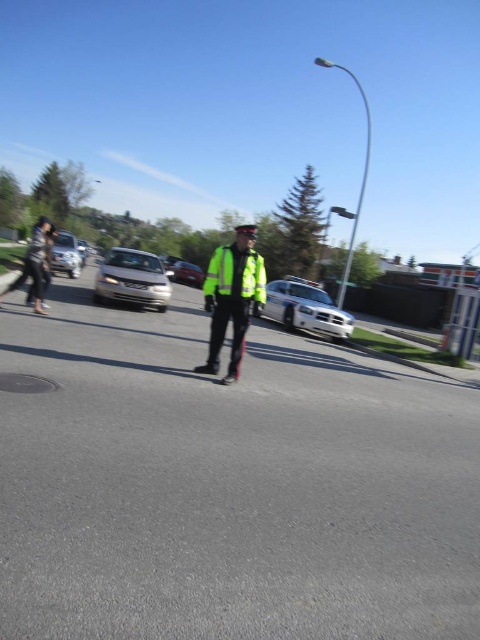
Does high visibility reflective jacket at center have a lesser height compared to satin silver sedan at center?

Yes, high visibility reflective jacket at center is shorter than satin silver sedan at center.

Does high visibility reflective jacket at center have a smaller size compared to satin silver sedan at center?

Indeed, high visibility reflective jacket at center has a smaller size compared to satin silver sedan at center.

Does point (250, 260) lie in front of point (97, 284)?

Yes.

Identify the location of high visibility reflective jacket at center. (231, 298).

Is white glossy police car at center smaller than silver metallic sedan at left?

Indeed, white glossy police car at center has a smaller size compared to silver metallic sedan at left.

The image size is (480, 640). What are the coordinates of `white glossy police car at center` in the screenshot? It's located at (305, 308).

I want to click on white glossy police car at center, so click(305, 308).

Does satin silver sedan at center have a smaller size compared to white glossy police car at center?

Actually, satin silver sedan at center might be larger than white glossy police car at center.

In the scene shown: Is satin silver sedan at center positioned at the back of white glossy police car at center?

Yes, satin silver sedan at center is behind white glossy police car at center.

Is point (120, 273) less distant than point (342, 336)?

That is True.

Identify the location of satin silver sedan at center. Image resolution: width=480 pixels, height=640 pixels. tap(132, 278).